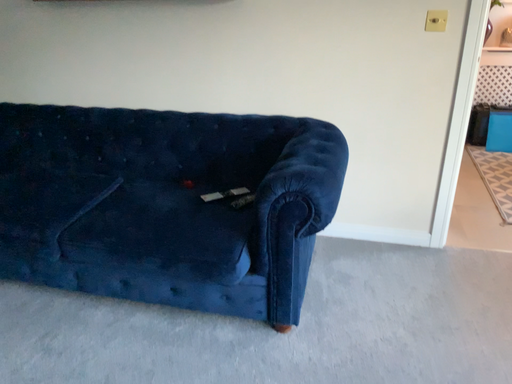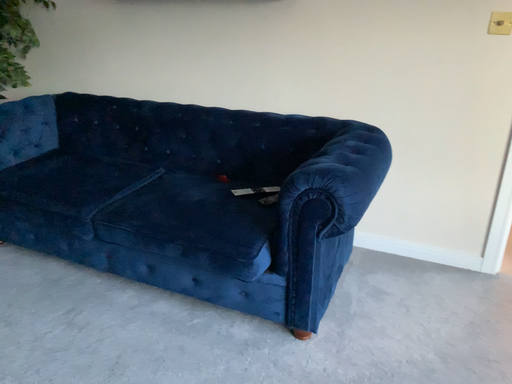
Question: Which way did the camera rotate in the video?

Choices:
 (A) rotated left
 (B) rotated right

Answer: (A)